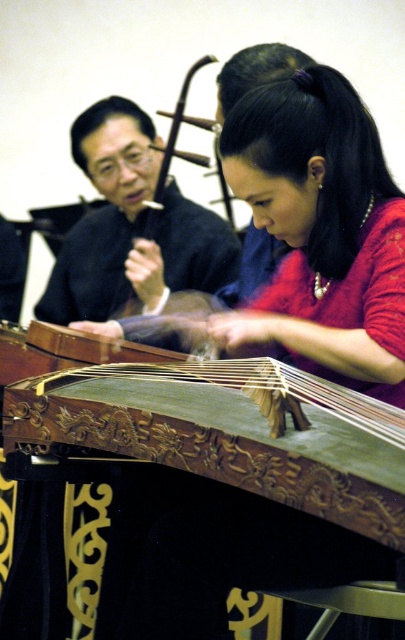
You are a photographer trying to capture both the carved wood zither at center and the matte green wooden instrument at center in a single shot. Based on their positions, which instrument should you position closer to the left side of your camera frame to ensure both are fully visible?

You should position the carved wood zither at center closer to the left side of your camera frame since it is already to the left of the matte green wooden instrument at center, ensuring both instruments are captured without overlap.

You are a stagehand setting up for a traditional music performance. You need to place the matte green wooden instrument at center and the matte black robe at upper left on a narrow shelf. Which object should you place first to ensure they both fit?

The matte green wooden instrument at center is thinner than the matte black robe at upper left, so you should place the matte black robe at upper left first to ensure both fit on the narrow shelf.

You are a photographer trying to capture a closeup of the matte green wooden instrument at center and the matte black robe at upper left. Since you can only focus on one object at a time, which one should you focus on first if you want to ensure the other is in the background?

You should focus on the matte green wooden instrument at center first because it is to the right of the matte black robe at upper left, so the matte black robe at upper left will naturally be in the background if the camera is positioned to capture the instrument in focus.